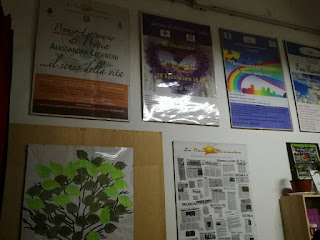
Find the location of `posters`. posters is located at coordinates (307, 96), (260, 89), (174, 84), (99, 66), (90, 167), (202, 202).